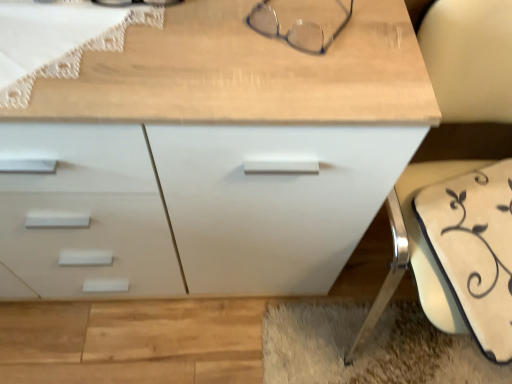
The height and width of the screenshot is (384, 512). In order to click on free location in front of clear plastic glasses at upper center in this screenshot , I will do `click(290, 92)`.